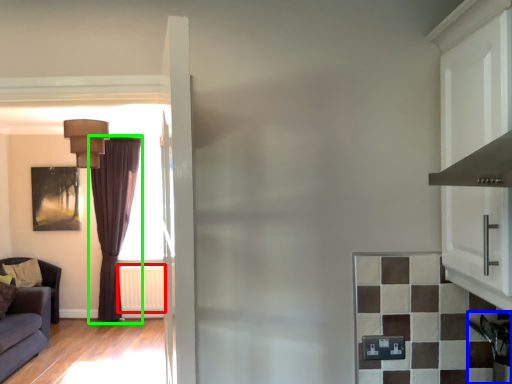
Question: Which object is positioned farthest from radiator (highlighted by a red box)? Select from appliance (highlighted by a blue box) and curtain (highlighted by a green box).

Choices:
 (A) appliance
 (B) curtain

Answer: (A)